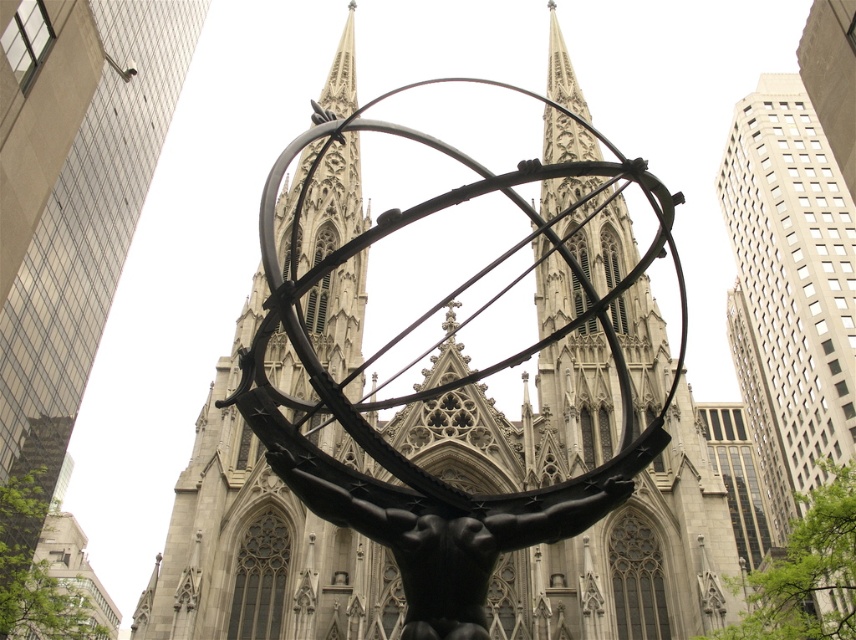
Does polished bronze atlas at center appear over black polished statue at center?

Yes.

Locate an element on the screen. polished bronze atlas at center is located at coordinates [259, 541].

I want to click on polished bronze atlas at center, so click(x=259, y=541).